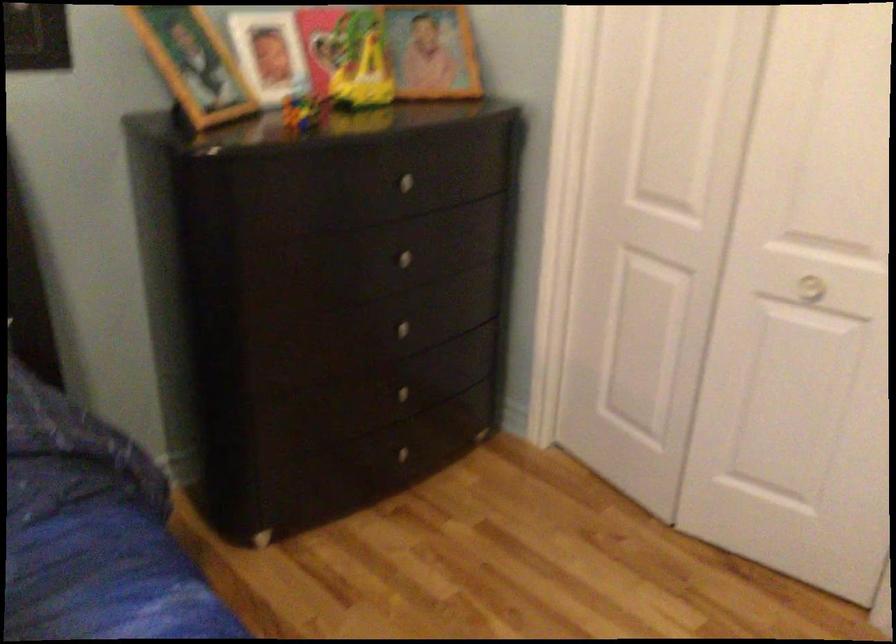
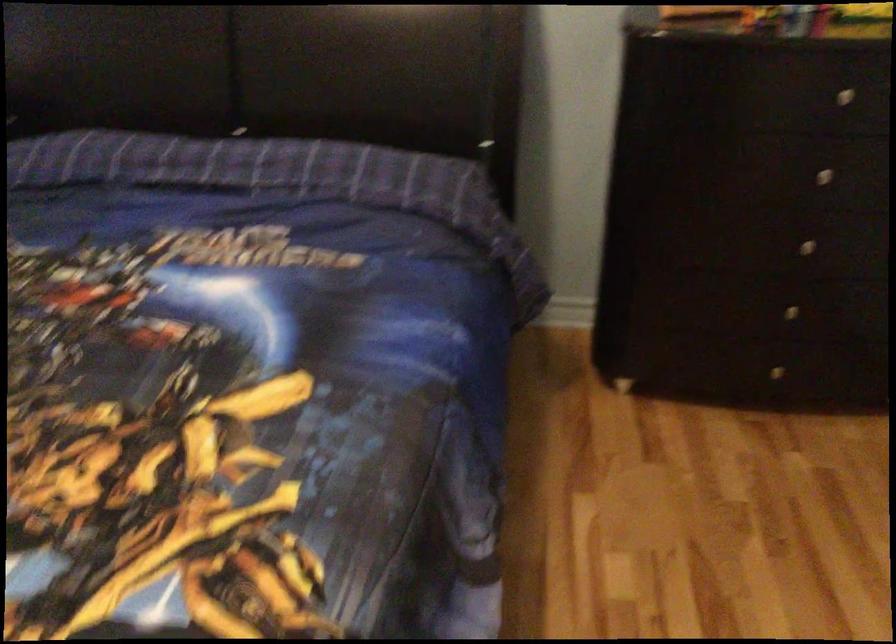
Question: The camera is either moving clockwise (left) or counter-clockwise (right) around the object. The first image is from the beginning of the video and the second image is from the end. Is the camera moving left or right when shooting the video?

Choices:
 (A) Left
 (B) Right

Answer: (B)